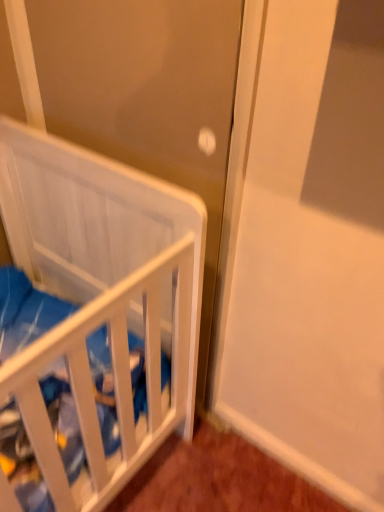
Locate an element on the screen. The image size is (384, 512). white matte crib at left is located at coordinates (102, 291).

Describe the element at coordinates (102, 291) in the screenshot. This screenshot has height=512, width=384. I see `white matte crib at left` at that location.

Find the location of a particular element. The height and width of the screenshot is (512, 384). white matte crib at left is located at coordinates (102, 291).